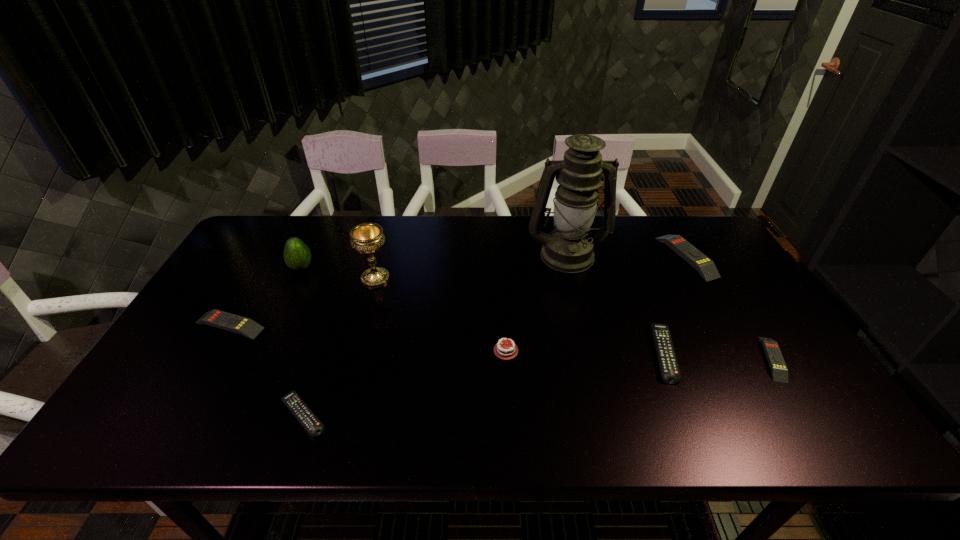
This screenshot has width=960, height=540. Identify the location of the tallest object. (569, 249).

Identify the location of oil lamp. Image resolution: width=960 pixels, height=540 pixels. (569, 249).

Find the location of a particular element. This screenshot has width=960, height=540. the eighth shortest object is located at coordinates (367, 238).

At what (x,y) coordinates should I click in order to perform the action: click on green avocado. Please return your answer as a coordinate pair (x, y). The width and height of the screenshot is (960, 540). Looking at the image, I should click on (297, 256).

Where is `the seventh shortest object`? the seventh shortest object is located at coordinates (297, 256).

I want to click on the farthest yellow remote control, so click(x=705, y=266).

Find the location of `the farthest remote control`. the farthest remote control is located at coordinates (705, 266).

The width and height of the screenshot is (960, 540). I want to click on red chocolate cake, so click(x=501, y=351).

You are a GUI agent. You are given a task and a screenshot of the screen. Output one action in this format:
    pyautogui.click(x=<x>, y=<y>)
    Task: Click on the chocolate cake
    The height and width of the screenshot is (540, 960).
    Given the screenshot: What is the action you would take?
    pyautogui.click(x=501, y=351)

In order to click on the second tallest remote control in this screenshot , I will do `click(247, 327)`.